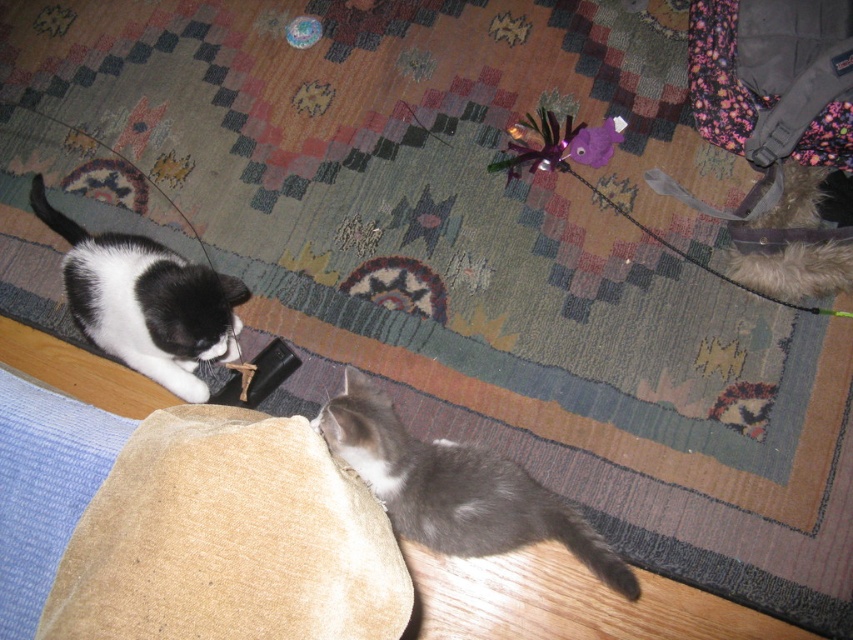
Can you confirm if gray fluffy cat at lower right is thinner than black matte fur cat at left?

In fact, gray fluffy cat at lower right might be wider than black matte fur cat at left.

Can you confirm if gray fluffy cat at lower right is positioned above black matte fur cat at left?

No, gray fluffy cat at lower right is not above black matte fur cat at left.

Image resolution: width=853 pixels, height=640 pixels. Find the location of `gray fluffy cat at lower right`. gray fluffy cat at lower right is located at coordinates (456, 486).